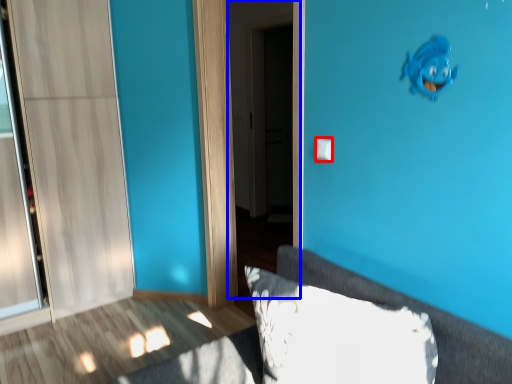
Question: Which object is further to the camera taking this photo, light switch (highlighted by a red box) or screen door (highlighted by a blue box)?

Choices:
 (A) light switch
 (B) screen door

Answer: (B)